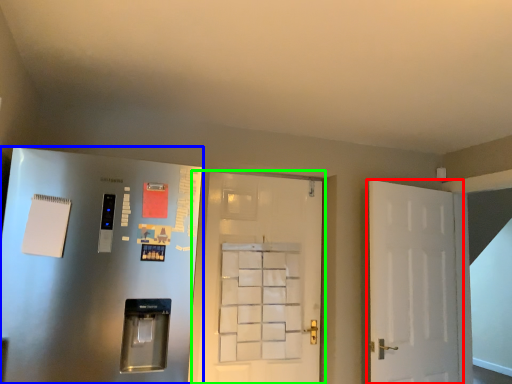
Question: Estimate the real-world distances between objects in this image. Which object is farther from door (highlighted by a red box), door (highlighted by a blue box) or door (highlighted by a green box)?

Choices:
 (A) door
 (B) door

Answer: (A)